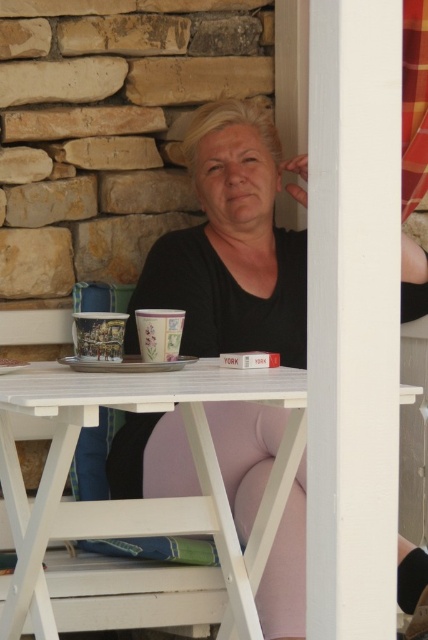
At what (x,y) coordinates should I click in order to perform the action: click on white painted wood at right. Please return your answer as a coordinate pair (x, y). This screenshot has height=640, width=428. Looking at the image, I should click on (353, 316).

Does matte black shirt at center have a lesser width compared to white wood picnic table at center?

Correct, matte black shirt at center's width is less than white wood picnic table at center's.

Describe the element at coordinates (231, 244) in the screenshot. I see `matte black shirt at center` at that location.

The image size is (428, 640). Find the location of `matte black shirt at center`. matte black shirt at center is located at coordinates (231, 244).

Is white painted wood at right below white wood picnic table at center?

Actually, white painted wood at right is above white wood picnic table at center.

Does white painted wood at right appear over white wood picnic table at center?

Indeed, white painted wood at right is positioned over white wood picnic table at center.

Identify the location of white painted wood at right. The width and height of the screenshot is (428, 640). (353, 316).